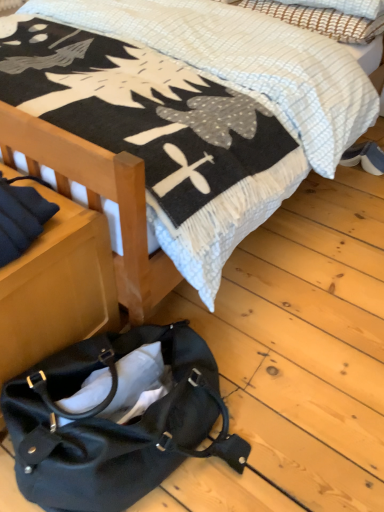
Question: Is there a large distance between blue suede shoes at lower right and matte black handbag at lower left?

Choices:
 (A) yes
 (B) no

Answer: (A)

Question: Is blue suede shoes at lower right at the right side of matte black handbag at lower left?

Choices:
 (A) no
 (B) yes

Answer: (B)

Question: Is blue suede shoes at lower right aimed at matte black handbag at lower left?

Choices:
 (A) yes
 (B) no

Answer: (A)

Question: Can you confirm if blue suede shoes at lower right is thinner than matte black handbag at lower left?

Choices:
 (A) no
 (B) yes

Answer: (B)

Question: Considering the relative sizes of blue suede shoes at lower right and matte black handbag at lower left in the image provided, is blue suede shoes at lower right bigger than matte black handbag at lower left?

Choices:
 (A) yes
 (B) no

Answer: (B)

Question: From the image's perspective, is blue suede shoes at lower right over matte black handbag at lower left?

Choices:
 (A) no
 (B) yes

Answer: (B)

Question: Is soft cotton blanket at upper center positioned before woven fabric pillow at upper right?

Choices:
 (A) no
 (B) yes

Answer: (B)

Question: From a real-world perspective, is soft cotton blanket at upper center located higher than woven fabric pillow at upper right?

Choices:
 (A) yes
 (B) no

Answer: (B)

Question: Is soft cotton blanket at upper center with woven fabric pillow at upper right?

Choices:
 (A) yes
 (B) no

Answer: (B)

Question: Is soft cotton blanket at upper center aimed at woven fabric pillow at upper right?

Choices:
 (A) no
 (B) yes

Answer: (A)

Question: Is soft cotton blanket at upper center not inside woven fabric pillow at upper right?

Choices:
 (A) no
 (B) yes

Answer: (B)

Question: Can you confirm if soft cotton blanket at upper center is bigger than woven fabric pillow at upper right?

Choices:
 (A) yes
 (B) no

Answer: (A)

Question: Can we say blue suede shoes at lower right lies outside soft cotton blanket at upper center?

Choices:
 (A) no
 (B) yes

Answer: (A)